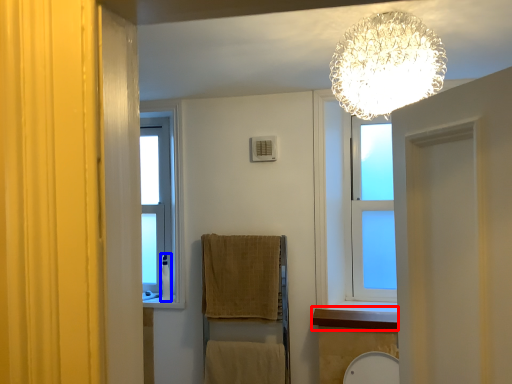
Question: Which object is closer to the camera taking this photo, window sill (highlighted by a red box) or toiletry (highlighted by a blue box)?

Choices:
 (A) window sill
 (B) toiletry

Answer: (A)